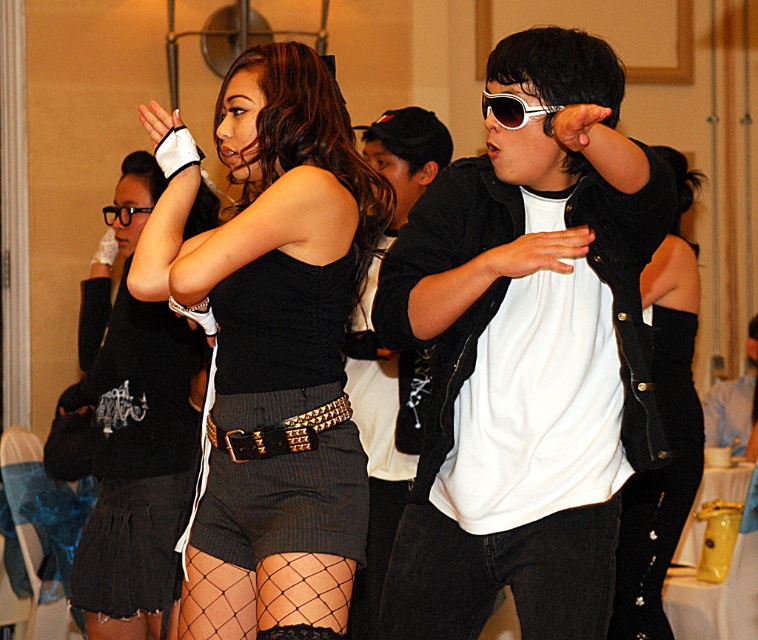
Between black velvet vest at right and black plastic glasses at upper left, which one appears on the right side from the viewer's perspective?

Positioned to the right is black velvet vest at right.

Looking at this image, is black velvet vest at right wider than black plastic glasses at upper left?

No, black velvet vest at right is not wider than black plastic glasses at upper left.

Between point (681, 204) and point (105, 212), which one is positioned in front?

Point (681, 204)

This screenshot has height=640, width=758. In order to click on black velvet vest at right in this screenshot , I will do `click(663, 429)`.

Does black matte tank top at center have a lesser height compared to black velvet vest at right?

Indeed, black matte tank top at center has a lesser height compared to black velvet vest at right.

Measure the distance from black matte tank top at center to black velvet vest at right.

black matte tank top at center and black velvet vest at right are 6.44 feet apart.

Who is more forward, (171,284) or (681,268)?

Point (171,284)

The width and height of the screenshot is (758, 640). I want to click on black matte tank top at center, so click(x=280, y=356).

Is point (356, 273) closer to viewer compared to point (113, 218)?

Yes, point (356, 273) is in front of point (113, 218).

Looking at this image, is black matte tank top at center bigger than black plastic glasses at upper left?

Yes.

Is point (277, 365) positioned before point (116, 214)?

Yes, it is in front of point (116, 214).

Identify the location of black matte tank top at center. The image size is (758, 640). (280, 356).